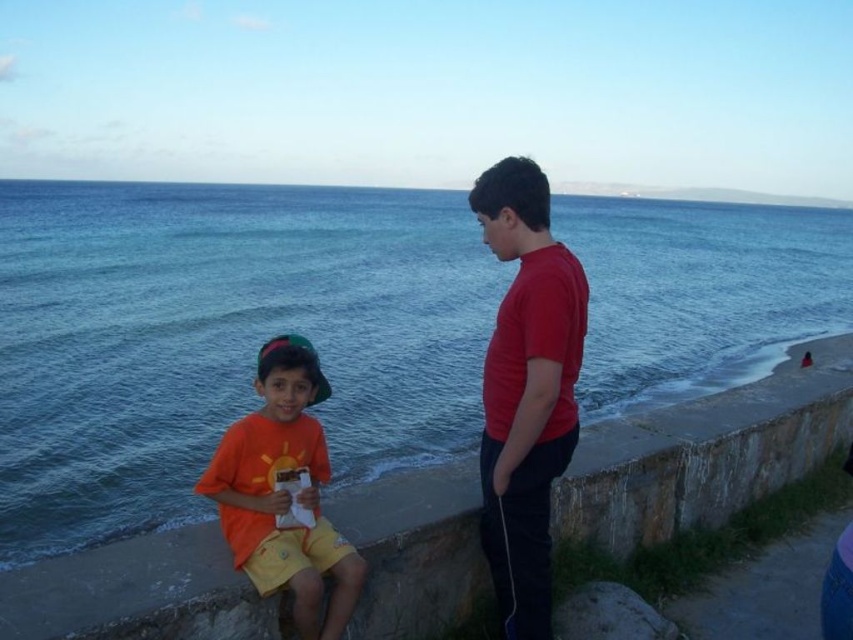
Question: Is matte red shirt at right to the right of orange matte shirt at center from the viewer's perspective?

Choices:
 (A) yes
 (B) no

Answer: (A)

Question: Can you confirm if blue water at sea left is smaller than orange matte shirt at center?

Choices:
 (A) yes
 (B) no

Answer: (B)

Question: Can you confirm if matte red shirt at right is positioned to the left of orange matte shirt at center?

Choices:
 (A) yes
 (B) no

Answer: (B)

Question: Which of these objects is positioned closest to the matte red shirt at right?

Choices:
 (A) blue water at sea left
 (B) orange matte shirt at center

Answer: (B)

Question: Which object is closer to the camera taking this photo?

Choices:
 (A) orange matte shirt at center
 (B) blue water at sea left
 (C) matte red shirt at right

Answer: (A)

Question: Considering the real-world distances, which object is closest to the matte red shirt at right?

Choices:
 (A) blue water at sea left
 (B) orange matte shirt at center

Answer: (B)